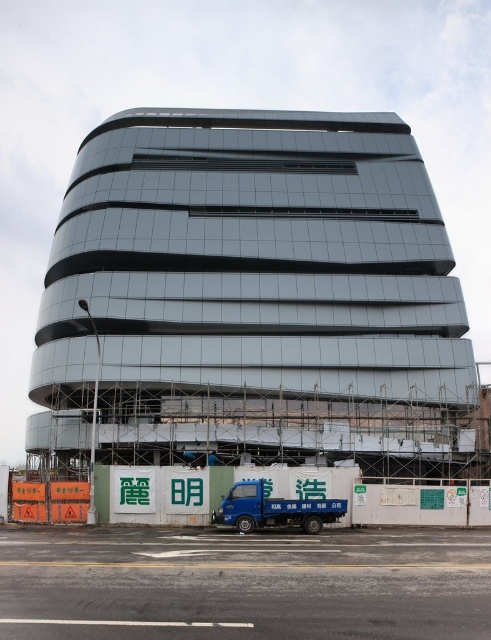
Is glassy metallic building at center below blue metallic truck at lower center?

No, glassy metallic building at center is not below blue metallic truck at lower center.

Between point (159, 292) and point (269, 497), which one is positioned in front?

Point (269, 497)

Image resolution: width=491 pixels, height=640 pixels. I want to click on glassy metallic building at center, so click(x=253, y=298).

At what (x,y) coordinates should I click in order to perform the action: click on glassy metallic building at center. Please return your answer as a coordinate pair (x, y). Looking at the image, I should click on (253, 298).